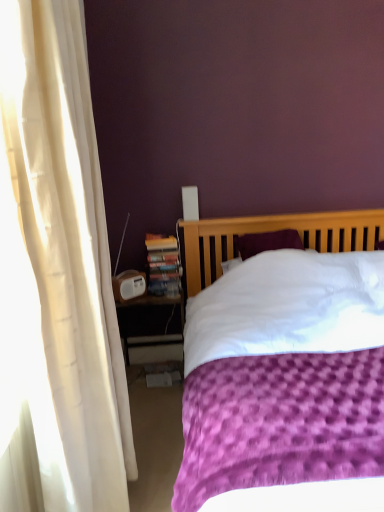
Question: Is purple textured bed at center far from hardcover book at left?

Choices:
 (A) no
 (B) yes

Answer: (A)

Question: Considering the relative sizes of purple textured bed at center and hardcover book at left in the image provided, is purple textured bed at center taller than hardcover book at left?

Choices:
 (A) yes
 (B) no

Answer: (A)

Question: Does purple textured bed at center have a lesser width compared to hardcover book at left?

Choices:
 (A) yes
 (B) no

Answer: (B)

Question: Is purple textured bed at center bigger than hardcover book at left?

Choices:
 (A) no
 (B) yes

Answer: (B)

Question: From the image's perspective, is purple textured bed at center on top of hardcover book at left?

Choices:
 (A) yes
 (B) no

Answer: (B)

Question: Would you say hardcover book at left is inside or outside purple textured bed at center?

Choices:
 (A) inside
 (B) outside

Answer: (B)

Question: Relative to purple textured bed at center, is hardcover book at left in front or behind?

Choices:
 (A) front
 (B) behind

Answer: (B)

Question: From the image's perspective, is hardcover book at left positioned above or below purple textured bed at center?

Choices:
 (A) above
 (B) below

Answer: (A)

Question: Is point (147, 289) positioned closer to the camera than point (306, 493)?

Choices:
 (A) farther
 (B) closer

Answer: (A)

Question: Is white plastic nightstand at lower left spatially inside hardcover book at left, or outside of it?

Choices:
 (A) outside
 (B) inside

Answer: (A)

Question: Is white plastic nightstand at lower left in front of or behind hardcover book at left in the image?

Choices:
 (A) front
 (B) behind

Answer: (A)

Question: Would you say white plastic nightstand at lower left is to the left or to the right of hardcover book at left in the picture?

Choices:
 (A) right
 (B) left

Answer: (B)

Question: In terms of width, does white plastic nightstand at lower left look wider or thinner when compared to hardcover book at left?

Choices:
 (A) thin
 (B) wide

Answer: (B)

Question: In the image, is purple textured bed at center positioned in front of or behind white plastic nightstand at lower left?

Choices:
 (A) behind
 (B) front

Answer: (B)

Question: Choose the correct answer: Is purple textured bed at center inside white plastic nightstand at lower left or outside it?

Choices:
 (A) outside
 (B) inside

Answer: (A)